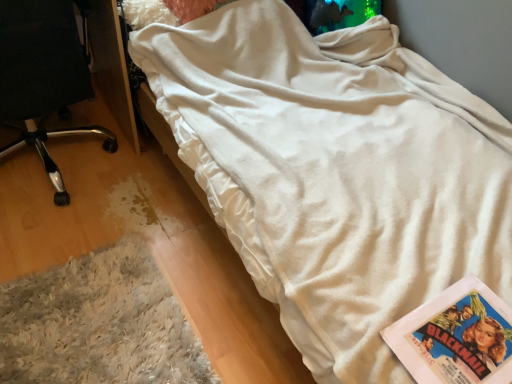
Locate an element on the screen. The height and width of the screenshot is (384, 512). black fabric chair at left is located at coordinates (42, 75).

The width and height of the screenshot is (512, 384). Describe the element at coordinates (42, 75) in the screenshot. I see `black fabric chair at left` at that location.

Locate an element on the screen. black fabric chair at left is located at coordinates (42, 75).